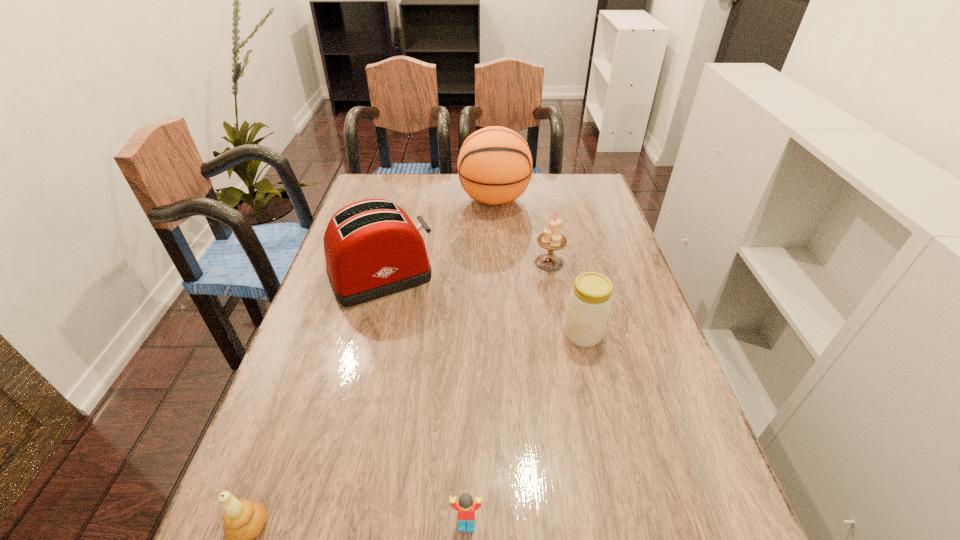
The height and width of the screenshot is (540, 960). In order to click on free location located on the front of the farther candle_holder in this screenshot , I will do `click(554, 289)`.

At what (x,y) coordinates should I click in order to perform the action: click on object that is at the far edge. Please return your answer as a coordinate pair (x, y). Looking at the image, I should click on (494, 165).

I want to click on object that is at the left edge, so click(372, 249).

I want to click on object that is positioned at the right edge, so click(x=590, y=300).

Locate an element on the screen. free space at the far edge of the desktop is located at coordinates (433, 198).

Where is `free space at the left edge of the desktop`? free space at the left edge of the desktop is located at coordinates (367, 313).

Locate an element on the screen. The image size is (960, 540). free spot at the right edge of the desktop is located at coordinates (632, 326).

The image size is (960, 540). I want to click on free location at the far left corner, so click(x=362, y=199).

I want to click on free space that is in between the second tallest object and the fourth farthest object, so click(482, 305).

This screenshot has width=960, height=540. In order to click on vacant point located between the farthest object and the shortest object in this screenshot , I will do `click(480, 362)`.